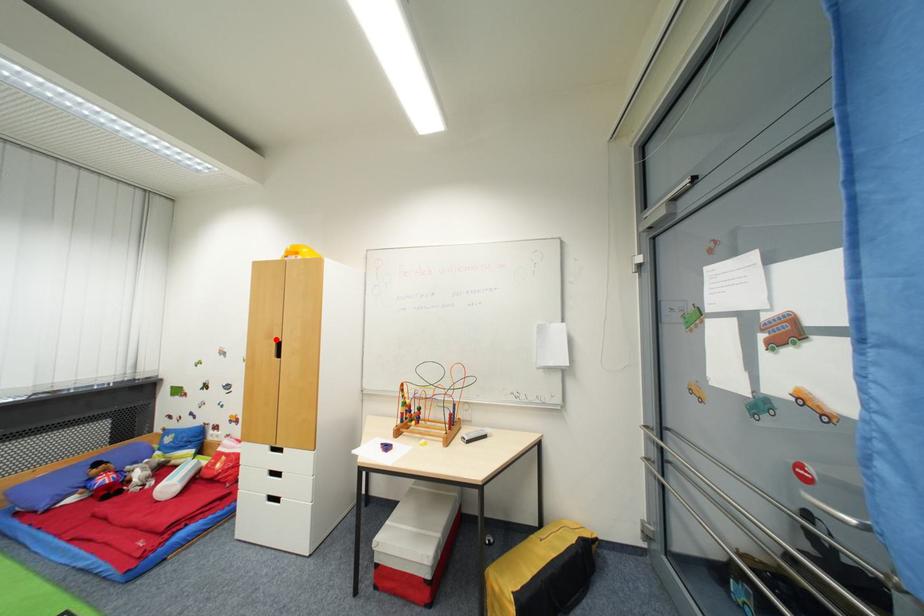
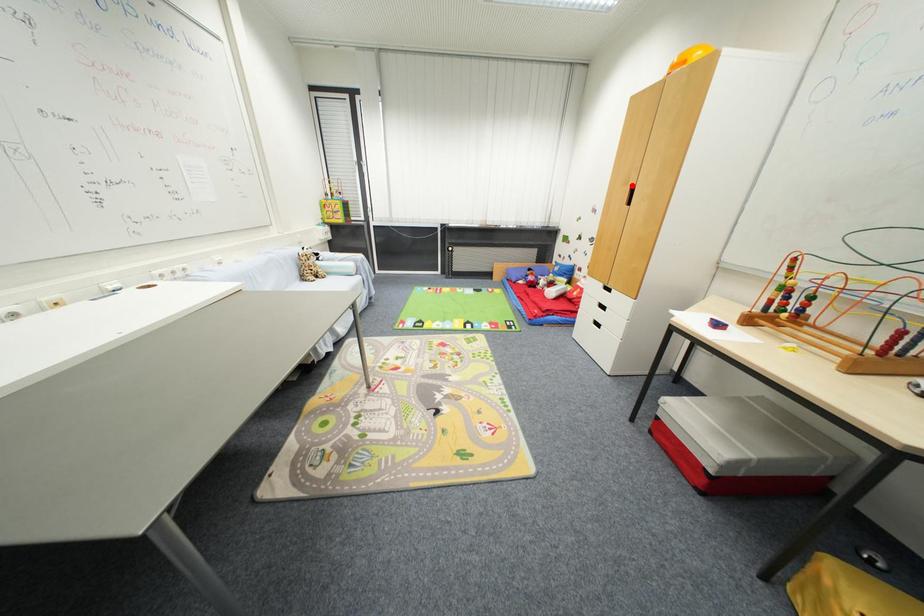
I am providing you with two images of the same scene from different viewpoints. A red point is marked on the first image and another point is marked on the second image. Does the point marked in image1 correspond to the same location as the one in image2?

Yes